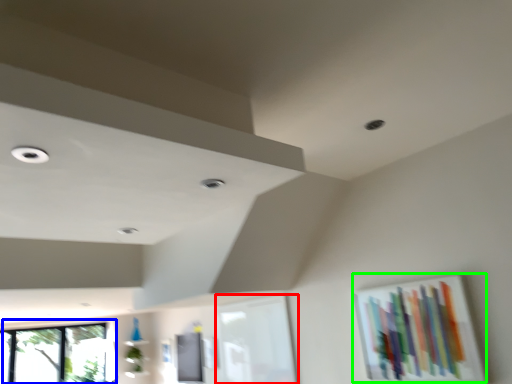
Question: Which object is positioned closest to window frame (highlighted by a red box)? Select from window (highlighted by a blue box) and picture frame (highlighted by a green box).

Choices:
 (A) window
 (B) picture frame

Answer: (B)